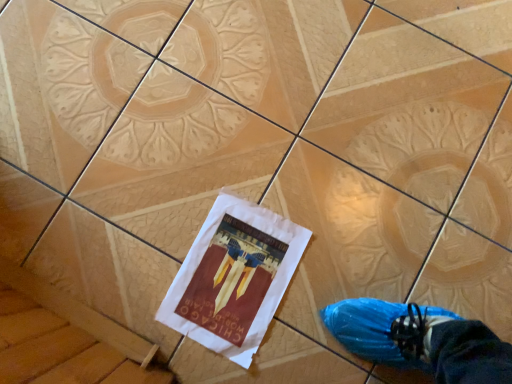
Where is `empty space that is to the right of white paper postcard at lower left`? The image size is (512, 384). empty space that is to the right of white paper postcard at lower left is located at coordinates (340, 274).